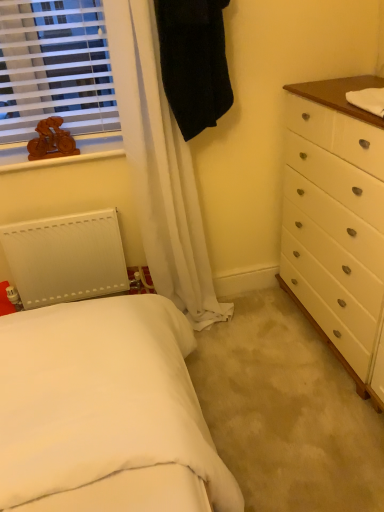
Question: From the image's perspective, relative to black fabric robe at upper center, is white matte radiator at lower left above or below?

Choices:
 (A) below
 (B) above

Answer: (A)

Question: Considering their positions, is white matte radiator at lower left located in front of or behind black fabric robe at upper center?

Choices:
 (A) front
 (B) behind

Answer: (B)

Question: Estimate the real-world distances between objects in this image. Which object is farther from the white matte radiator at lower left?

Choices:
 (A) wooden bicycle at upper left
 (B) wooden bicycle at upper left
 (C) black fabric robe at upper center
 (D) brown wooden counter top at upper right
 (E) wooden bicycle at upper left

Answer: (D)

Question: Considering the real-world distances, which object is farthest from the wooden bicycle at upper left?

Choices:
 (A) wooden bicycle at upper left
 (B) white matte radiator at lower left
 (C) wooden bicycle at upper left
 (D) black fabric robe at upper center
 (E) brown wooden counter top at upper right

Answer: (E)